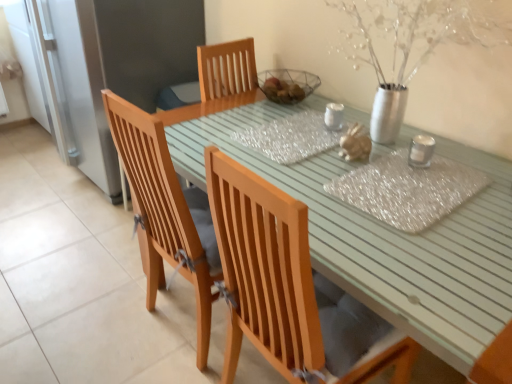
Question: From a real-world perspective, is wooden chair at center, the second chair in the bottom-to-top sequence, positioned over translucent glass jar at center based on gravity?

Choices:
 (A) yes
 (B) no

Answer: (B)

Question: Is there a large distance between wooden chair at center, the second chair in the bottom-to-top sequence, and translucent glass jar at center?

Choices:
 (A) yes
 (B) no

Answer: (B)

Question: Is wooden chair at center, which is the 1th chair in top-to-bottom order, behind translucent glass jar at center?

Choices:
 (A) yes
 (B) no

Answer: (B)

Question: Does wooden chair at center, which is the 1th chair in top-to-bottom order, have a greater width compared to translucent glass jar at center?

Choices:
 (A) yes
 (B) no

Answer: (A)

Question: Is wooden chair at center, which is the 1th chair in top-to-bottom order, to the right of translucent glass jar at center from the viewer's perspective?

Choices:
 (A) no
 (B) yes

Answer: (A)

Question: In terms of height, does wooden chair at center, the first chair ordered from the bottom, look taller or shorter compared to wooden chair at center, the second chair in the bottom-to-top sequence?

Choices:
 (A) tall
 (B) short

Answer: (B)

Question: Considering their positions, is wooden chair at center, positioned as the 2th chair in top-to-bottom order, located in front of or behind wooden chair at center, which is the 1th chair in top-to-bottom order?

Choices:
 (A) behind
 (B) front

Answer: (B)

Question: From a real-world perspective, is wooden chair at center, positioned as the 2th chair in top-to-bottom order, above or below wooden chair at center, the second chair in the bottom-to-top sequence?

Choices:
 (A) above
 (B) below

Answer: (A)

Question: In terms of width, does wooden chair at center, the first chair ordered from the bottom, look wider or thinner when compared to wooden chair at center, the second chair in the bottom-to-top sequence?

Choices:
 (A) thin
 (B) wide

Answer: (A)

Question: From the image's perspective, relative to wooden chair at center, positioned as the 2th chair in top-to-bottom order, is translucent glass jar at center above or below?

Choices:
 (A) below
 (B) above

Answer: (B)

Question: From their relative heights in the image, would you say translucent glass jar at center is taller or shorter than wooden chair at center, the first chair ordered from the bottom?

Choices:
 (A) tall
 (B) short

Answer: (A)

Question: Which is correct: translucent glass jar at center is inside wooden chair at center, positioned as the 2th chair in top-to-bottom order, or outside of it?

Choices:
 (A) outside
 (B) inside

Answer: (A)

Question: Considering the relative positions of translucent glass jar at center and wooden chair at center, the first chair ordered from the bottom, in the image provided, is translucent glass jar at center to the left or to the right of wooden chair at center, the first chair ordered from the bottom,?

Choices:
 (A) right
 (B) left

Answer: (A)

Question: Does point (223, 144) appear closer or farther from the camera than point (140, 251)?

Choices:
 (A) closer
 (B) farther

Answer: (A)

Question: From the image's perspective, is light green wooden table at center positioned above or below wooden chair at center, which is the 1th chair in top-to-bottom order?

Choices:
 (A) above
 (B) below

Answer: (B)